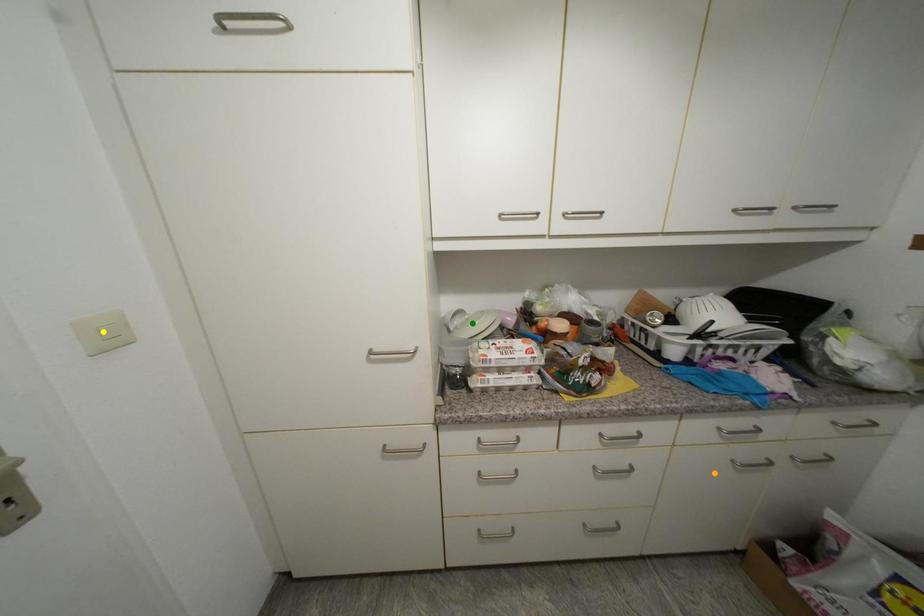
Order these from nearest to farthest:
yellow point, orange point, green point

1. yellow point
2. orange point
3. green point